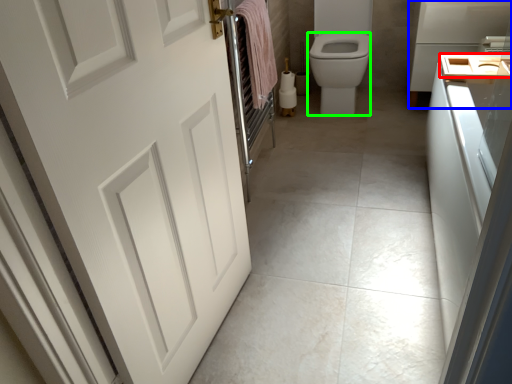
Question: Considering the real-world distances, which object is closest to sink (highlighted by a red box)? appliance (highlighted by a blue box) or bidet (highlighted by a green box).

Choices:
 (A) appliance
 (B) bidet

Answer: (A)